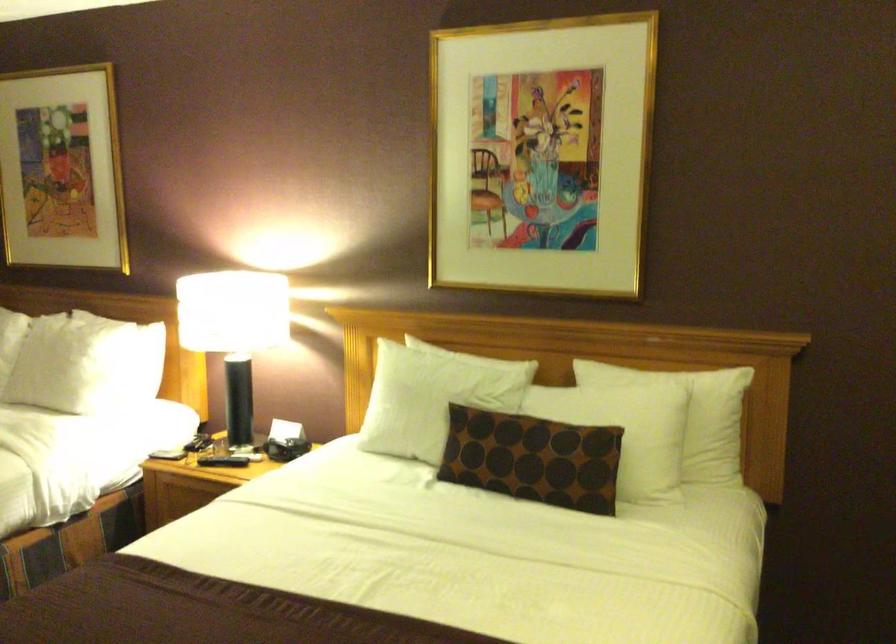
Find where to press the black phone buttons. Please return your answer as a coordinate pair (x, y).

(288, 448)